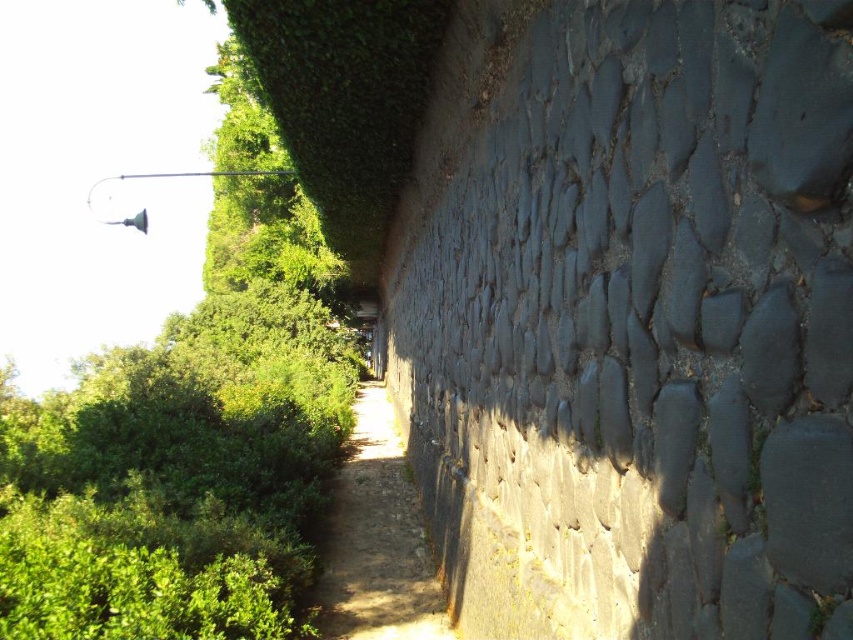
You are a hiker carrying a large backpack and need to walk along the dirt path at center. The dark gray stone wall at right is nearby. Considering their sizes, which one occupies more space in the image?

The dirt path at center occupies more space in the image because the dark gray stone wall at right is smaller than it.

You are standing at the point closer to the camera in the image. Which point are you at, point (782, 483) or point (372, 518)?

You are at point (782, 483) because it is closer to the camera than point (372, 518).

You are standing at the point marked as point (724, 476) on the narrow pathway bordered by a stone wall and greenery. You want to walk straight ahead. How far will you have to walk before you reach the end of the pathway?

You will have to walk 1.46 meters before reaching the end of the pathway because the distance between you and the viewer is 1.46 meters.